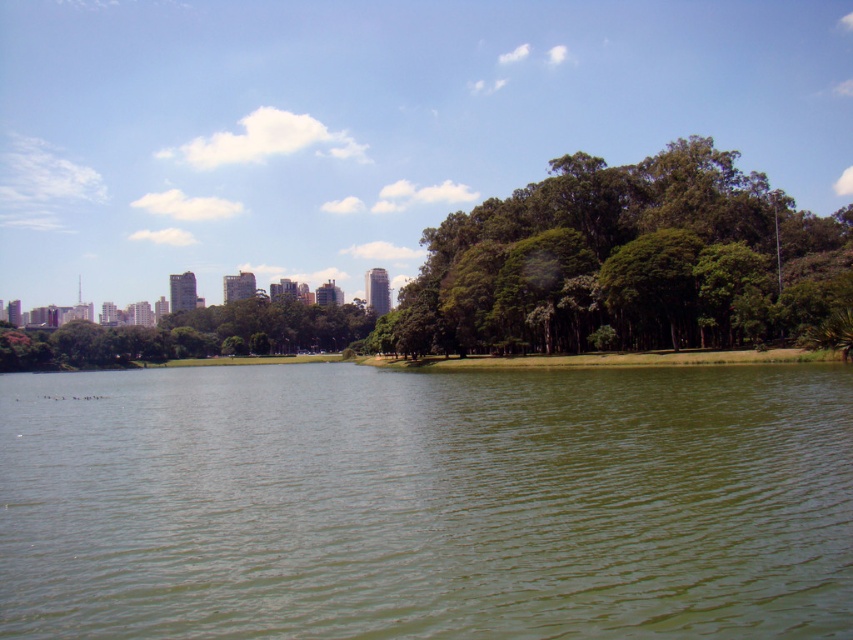
Question: Considering the real-world distances, which object is closest to the green leafy trees at center?

Choices:
 (A) green leafy tree at center
 (B) green water at center

Answer: (B)

Question: Which object appears closest to the camera in this image?

Choices:
 (A) green leafy trees at center
 (B) green leafy tree at center

Answer: (A)

Question: Does green water at center have a smaller size compared to green leafy tree at center?

Choices:
 (A) no
 (B) yes

Answer: (B)

Question: Can you confirm if green leafy trees at center is smaller than green leafy tree at center?

Choices:
 (A) no
 (B) yes

Answer: (B)

Question: Is the position of green leafy trees at center more distant than that of green leafy tree at center?

Choices:
 (A) yes
 (B) no

Answer: (B)

Question: Which object appears closest to the camera in this image?

Choices:
 (A) green leafy trees at center
 (B) green water at center
 (C) green leafy tree at center

Answer: (B)